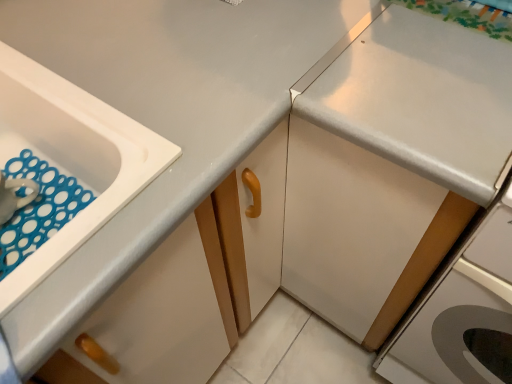
At what (x,y) coordinates should I click in order to perform the action: click on white glossy cabinet at right. Please return your answer as a coordinate pair (x, y). Looking at the image, I should click on (462, 312).

Based on the photo, what is the approximate width of white plastic sink at left?

white plastic sink at left is 18.13 inches in width.

What are the coordinates of `white glossy drawer at lower left` in the screenshot? It's located at (154, 322).

The width and height of the screenshot is (512, 384). What do you see at coordinates (154, 322) in the screenshot? I see `white glossy drawer at lower left` at bounding box center [154, 322].

What are the coordinates of `white glossy cabinet at right` in the screenshot? It's located at (462, 312).

Does white glossy countertop at upper right come in front of white plastic sink at left?

No, the depth of white glossy countertop at upper right is greater than that of white plastic sink at left.

Is white glossy countertop at upper right thinner than white plastic sink at left?

Incorrect, the width of white glossy countertop at upper right is not less than that of white plastic sink at left.

Is white glossy countertop at upper right facing away from white plastic sink at left?

white glossy countertop at upper right does not have its back to white plastic sink at left.

Which is more to the left, white glossy countertop at upper right or white plastic sink at left?

Positioned to the left is white plastic sink at left.

Can you see white plastic sink at left touching white glossy countertop at upper right?

No, white plastic sink at left is not beside white glossy countertop at upper right.

Is white plastic sink at left completely or partially outside of white glossy countertop at upper right?

Yes.

Measure the distance from white plastic sink at left to white glossy countertop at upper right.

The distance of white plastic sink at left from white glossy countertop at upper right is 14.24 inches.

Is white plastic sink at left smaller than white glossy countertop at upper right?

Indeed, white plastic sink at left has a smaller size compared to white glossy countertop at upper right.

At what (x,y) coordinates should I click in order to perform the action: click on countertop above the white glossy cabinet at right (from a real-world perspective). Please return your answer as a coordinate pair (x, y). The height and width of the screenshot is (384, 512). Looking at the image, I should click on (421, 99).

Which is more to the left, white glossy cabinet at right or white glossy countertop at upper right?

Positioned to the left is white glossy countertop at upper right.

In terms of height, does white glossy cabinet at right look taller or shorter compared to white glossy countertop at upper right?

white glossy cabinet at right is shorter than white glossy countertop at upper right.

Is white glossy cabinet at right far from white glossy countertop at upper right?

That's not correct — white glossy cabinet at right is a little close to white glossy countertop at upper right.

This screenshot has height=384, width=512. In order to click on home appliance to the right of white glossy countertop at upper right in this screenshot , I will do `click(462, 312)`.

Would you say white glossy cabinet at right is part of white glossy countertop at upper right's contents?

No, white glossy cabinet at right is not inside white glossy countertop at upper right.

Can you tell me how much white glossy countertop at upper right and white glossy cabinet at right differ in facing direction?

white glossy countertop at upper right and white glossy cabinet at right are facing 0.421 degrees away from each other.

Does point (360, 79) appear closer or farther from the camera than point (460, 270)?

Clearly, point (360, 79) is closer to the camera than point (460, 270).

Does white glossy drawer at lower left appear on the left side of white glossy countertop at upper right?

Yes.

The image size is (512, 384). I want to click on countertop lying behind the white glossy drawer at lower left, so click(x=421, y=99).

Considering their positions, is white glossy drawer at lower left located in front of or behind white glossy countertop at upper right?

white glossy drawer at lower left is positioned closer to the viewer than white glossy countertop at upper right.

Between point (484, 290) and point (178, 274), which one is positioned in front?

The point (484, 290) is closer to the camera.

Which is behind, white glossy cabinet at right or white glossy drawer at lower left?

white glossy cabinet at right is further away from the camera.

From a real-world perspective, is white glossy cabinet at right positioned over white glossy drawer at lower left based on gravity?

No, from a real-world perspective, white glossy cabinet at right is not over white glossy drawer at lower left

From the image's perspective, is white glossy drawer at lower left located above or below white plastic sink at left?

Clearly, from the image's perspective, white glossy drawer at lower left is below white plastic sink at left.

How far apart are white glossy drawer at lower left and white plastic sink at left?

white glossy drawer at lower left and white plastic sink at left are 23.48 centimeters apart from each other.

From a real-world perspective, is white glossy drawer at lower left physically below white plastic sink at left?

No, from a real-world perspective, white glossy drawer at lower left is not beneath white plastic sink at left.

Does white glossy drawer at lower left appear on the left side of white plastic sink at left?

Incorrect, white glossy drawer at lower left is not on the left side of white plastic sink at left.

Where is `countertop directly beneath the white plastic sink at left (from a real-world perspective)`? This screenshot has width=512, height=384. countertop directly beneath the white plastic sink at left (from a real-world perspective) is located at coordinates (421, 99).

Image resolution: width=512 pixels, height=384 pixels. What are the coordinates of `countertop behind the white plastic sink at left` in the screenshot? It's located at (421, 99).

Which object lies further to the anchor point white glossy countertop at upper right, white glossy cabinet at right or white glossy drawer at lower left?

white glossy drawer at lower left.

Which object lies further to the anchor point white plastic sink at left, white glossy countertop at upper right or white glossy cabinet at right?

white glossy cabinet at right.

Looking at this image, considering their positions, is white glossy countertop at upper right positioned further to white glossy cabinet at right than white glossy drawer at lower left?

Among the two, white glossy drawer at lower left is located further to white glossy cabinet at right.

Which object lies nearer to the anchor point white glossy cabinet at right, white glossy drawer at lower left or white plastic sink at left?

white glossy drawer at lower left is positioned closer to the anchor white glossy cabinet at right.

Looking at the image, which one is located further to white glossy drawer at lower left, white glossy cabinet at right or white plastic sink at left?

white glossy cabinet at right is positioned further to the anchor white glossy drawer at lower left.

Considering their positions, is white glossy drawer at lower left positioned closer to white glossy cabinet at right than white glossy countertop at upper right?

white glossy countertop at upper right is positioned closer to the anchor white glossy cabinet at right.

Estimate the real-world distances between objects in this image. Which object is closer to white glossy cabinet at right, white glossy countertop at upper right or white plastic sink at left?

white glossy countertop at upper right.

Which object lies nearer to the anchor point white glossy countertop at upper right, white glossy drawer at lower left or white plastic sink at left?

Among the two, white plastic sink at left is located nearer to white glossy countertop at upper right.

What are the coordinates of `countertop between white plastic sink at left and white glossy cabinet at right in the horizontal direction` in the screenshot? It's located at (421, 99).

You are a GUI agent. You are given a task and a screenshot of the screen. Output one action in this format:
    pyautogui.click(x=<x>, y=<y>)
    Task: Click on the countertop between white glossy drawer at lower left and white glossy cabinet at right from left to right
    Image resolution: width=512 pixels, height=384 pixels.
    Given the screenshot: What is the action you would take?
    pyautogui.click(x=421, y=99)

What are the coordinates of `drawer between white plastic sink at left and white glossy cabinet at right` in the screenshot? It's located at (154, 322).

At what (x,y) coordinates should I click in order to perform the action: click on drawer located between white plastic sink at left and white glossy countertop at upper right in the left-right direction. Please return your answer as a coordinate pair (x, y). Looking at the image, I should click on (154, 322).